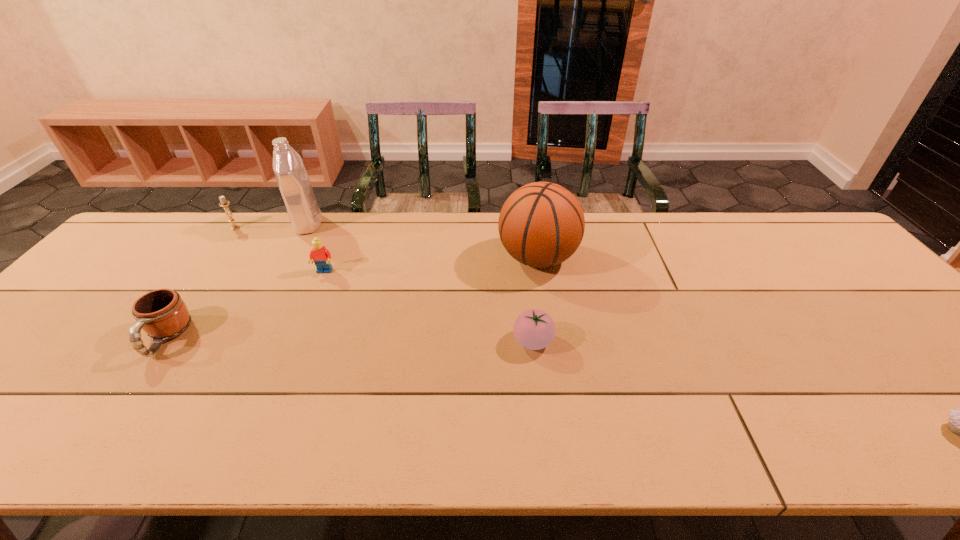
Find the location of `the fifth object from right to left`. the fifth object from right to left is located at coordinates (292, 179).

Identify the location of detergent. (292, 179).

Where is `the sixth shortest object`? The image size is (960, 540). the sixth shortest object is located at coordinates (541, 224).

Find the location of a particular element. candle holder is located at coordinates (223, 203).

Identify the location of Lego. (321, 256).

Locate an element on the screen. This screenshot has width=960, height=540. mug is located at coordinates point(162,314).

What are the coordinates of `tomato` in the screenshot? It's located at (534, 329).

Find the location of a particular element. This screenshot has height=540, width=960. vacant area located 0.250m on the front of the third object from left to right is located at coordinates (273, 291).

Locate an element on the screen. The height and width of the screenshot is (540, 960). free space located on the right of the basketball is located at coordinates (638, 258).

Locate an element on the screen. The width and height of the screenshot is (960, 540). free space located on the front of the candle holder is located at coordinates (191, 287).